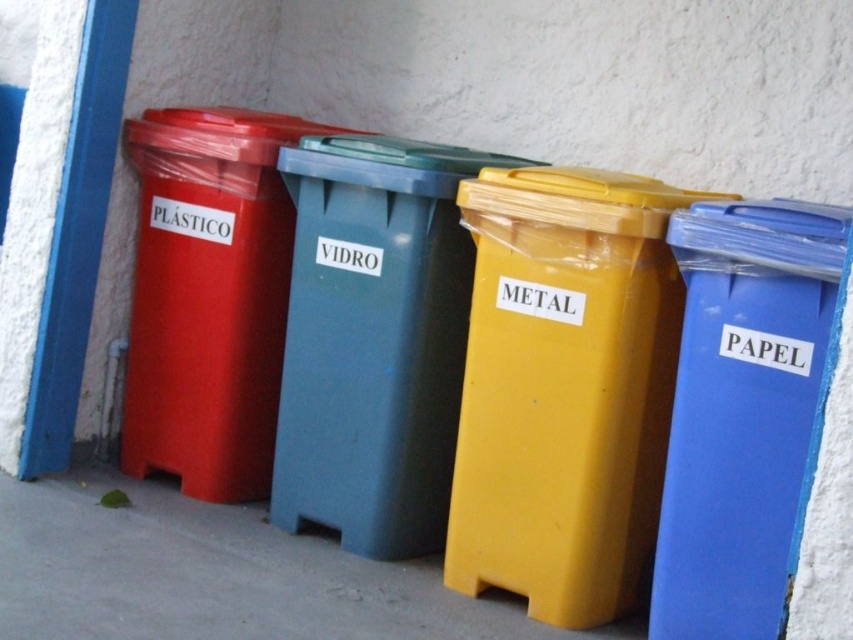
Is blue plastic paper at right shorter than matte plastic bin at left?

Yes.

Between blue plastic paper at right and matte plastic bin at left, which one has less height?

With less height is blue plastic paper at right.

The height and width of the screenshot is (640, 853). Describe the element at coordinates (741, 410) in the screenshot. I see `blue plastic paper at right` at that location.

This screenshot has height=640, width=853. In order to click on blue plastic paper at right in this screenshot , I will do `click(741, 410)`.

Does matte plastic trash can at left appear on the left side of yellow matte plastic bin at lower center?

No, matte plastic trash can at left is not to the left of yellow matte plastic bin at lower center.

Can you confirm if matte plastic trash can at left is bigger than yellow matte plastic bin at lower center?

Indeed, matte plastic trash can at left has a larger size compared to yellow matte plastic bin at lower center.

What do you see at coordinates (553, 376) in the screenshot?
I see `matte plastic trash can at left` at bounding box center [553, 376].

The image size is (853, 640). Find the location of `matte plastic trash can at left`. matte plastic trash can at left is located at coordinates (553, 376).

Looking at this image, is yellow matte metal bin at center smaller than yellow plastic/metallic trash can at center?

Correct, yellow matte metal bin at center occupies less space than yellow plastic/metallic trash can at center.

Between point (463, 499) and point (410, 260), which one is positioned in front?

Point (463, 499)

Is point (483, 422) farther from viewer compared to point (419, 452)?

No, (483, 422) is closer to viewer.

What are the coordinates of `yellow matte metal bin at center` in the screenshot? It's located at (564, 387).